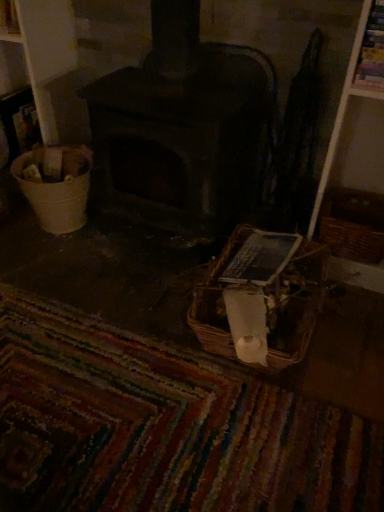
Question: Considering the relative sizes of white plastic bucket at left and brown woven basket at right, which appears as the second basket when viewed from the left, in the image provided, is white plastic bucket at left taller than brown woven basket at right, which appears as the second basket when viewed from the left,?

Choices:
 (A) yes
 (B) no

Answer: (A)

Question: Does white plastic bucket at left have a smaller size compared to brown woven basket at right, marked as the first basket in a right-to-left arrangement?

Choices:
 (A) no
 (B) yes

Answer: (A)

Question: Would you say white plastic bucket at left is outside brown woven basket at right, marked as the first basket in a right-to-left arrangement?

Choices:
 (A) yes
 (B) no

Answer: (A)

Question: From a real-world perspective, is white plastic bucket at left positioned over brown woven basket at right, marked as the first basket in a right-to-left arrangement, based on gravity?

Choices:
 (A) no
 (B) yes

Answer: (B)

Question: Does white plastic bucket at left have a lesser height compared to brown woven basket at right, marked as the first basket in a right-to-left arrangement?

Choices:
 (A) no
 (B) yes

Answer: (A)

Question: Can you confirm if white plastic bucket at left is positioned to the right of brown woven basket at right, marked as the first basket in a right-to-left arrangement?

Choices:
 (A) no
 (B) yes

Answer: (A)

Question: From the image's perspective, is multicolored woven mat at lower center beneath dark gray stone wood burning stove at center?

Choices:
 (A) yes
 (B) no

Answer: (A)

Question: Is multicolored woven mat at lower center not within dark gray stone wood burning stove at center?

Choices:
 (A) yes
 (B) no

Answer: (A)

Question: Is multicolored woven mat at lower center in front of dark gray stone wood burning stove at center?

Choices:
 (A) yes
 (B) no

Answer: (A)

Question: From a real-world perspective, is multicolored woven mat at lower center on dark gray stone wood burning stove at center?

Choices:
 (A) yes
 (B) no

Answer: (B)

Question: Considering the relative sizes of multicolored woven mat at lower center and dark gray stone wood burning stove at center in the image provided, is multicolored woven mat at lower center smaller than dark gray stone wood burning stove at center?

Choices:
 (A) no
 (B) yes

Answer: (A)

Question: Considering the relative sizes of multicolored woven mat at lower center and dark gray stone wood burning stove at center in the image provided, is multicolored woven mat at lower center wider than dark gray stone wood burning stove at center?

Choices:
 (A) no
 (B) yes

Answer: (B)

Question: From the image's perspective, is multicolored woven mat at lower center located beneath white plastic bucket at left?

Choices:
 (A) no
 (B) yes

Answer: (B)